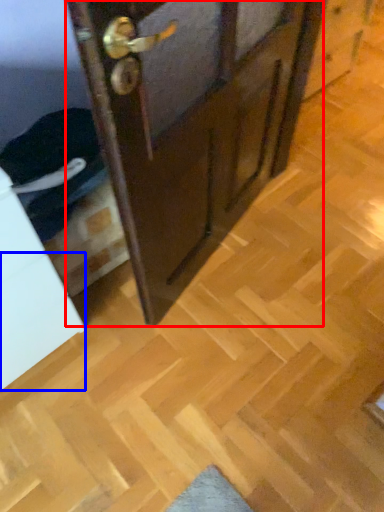
Question: Which of the following is the closest to the observer, door (highlighted by a red box) or drawer (highlighted by a blue box)?

Choices:
 (A) door
 (B) drawer

Answer: (A)